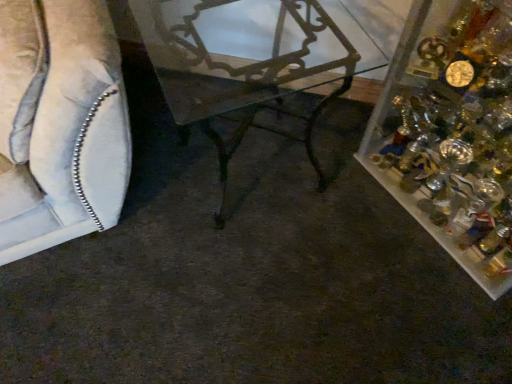
At what (x,y) coordinates should I click in order to perform the action: click on clear plastic container at right. Please return your answer as a coordinate pair (x, y). Looking at the image, I should click on (451, 132).

Locate an element on the screen. This screenshot has height=384, width=512. metallic wrought iron table at center is located at coordinates point(237,72).

Measure the distance between point (84,178) and camera.

Point (84,178) is 1.13 meters from camera.

You are a GUI agent. You are given a task and a screenshot of the screen. Output one action in this format:
    pyautogui.click(x=<x>, y=<y>)
    Task: Click on the clear plastic container at right
    The image size is (512, 384).
    Given the screenshot: What is the action you would take?
    pyautogui.click(x=451, y=132)

Measure the distance between metallic wrought iron table at center and suede-like beige sofa at left.

13.99 inches.

Who is more distant, metallic wrought iron table at center or suede-like beige sofa at left?

metallic wrought iron table at center is further away from the camera.

Looking at this image, is there a large distance between metallic wrought iron table at center and suede-like beige sofa at left?

No, metallic wrought iron table at center is not far away from suede-like beige sofa at left.

From a real-world perspective, does metallic wrought iron table at center sit lower than suede-like beige sofa at left?

Correct, in the physical world, metallic wrought iron table at center is lower than suede-like beige sofa at left.

What are the coordinates of `furniture positioned vertically above the clear plastic container at right (from a real-world perspective)` in the screenshot? It's located at (60, 124).

Looking at this image, looking at their sizes, would you say suede-like beige sofa at left is wider or thinner than clear plastic container at right?

suede-like beige sofa at left is wider than clear plastic container at right.

How many degrees apart are the facing directions of suede-like beige sofa at left and clear plastic container at right?

The angular difference between suede-like beige sofa at left and clear plastic container at right is 79.5 degrees.

Does suede-like beige sofa at left have a lesser height compared to clear plastic container at right?

No, suede-like beige sofa at left is not shorter than clear plastic container at right.

From the image's perspective, which one is positioned lower, suede-like beige sofa at left or metallic wrought iron table at center?

metallic wrought iron table at center, from the image's perspective.

At what (x,y) coordinates should I click in order to perform the action: click on table that appears behind the suede-like beige sofa at left. Please return your answer as a coordinate pair (x, y). This screenshot has width=512, height=384. Looking at the image, I should click on (237, 72).

Is point (18, 0) positioned in front of point (184, 119)?

That is True.

Is clear plastic container at right with suede-like beige sofa at left?

No, clear plastic container at right is not making contact with suede-like beige sofa at left.

Which object is closer to the camera taking this photo, clear plastic container at right or suede-like beige sofa at left?

suede-like beige sofa at left is closer to the camera.

Who is smaller, clear plastic container at right or metallic wrought iron table at center?

metallic wrought iron table at center.

From a real-world perspective, is clear plastic container at right located higher than metallic wrought iron table at center?

Correct, in the physical world, clear plastic container at right is higher than metallic wrought iron table at center.

From the image's perspective, is clear plastic container at right on metallic wrought iron table at center?

No, from the image's perspective, clear plastic container at right is not above metallic wrought iron table at center.

Does clear plastic container at right turn towards metallic wrought iron table at center?

No, clear plastic container at right is not oriented towards metallic wrought iron table at center.

Which is behind, point (220, 215) or point (429, 108)?

Positioned behind is point (429, 108).

Is metallic wrought iron table at center outside of clear plastic container at right?

Yes, metallic wrought iron table at center is outside of clear plastic container at right.

Is metallic wrought iron table at center facing away from clear plastic container at right?

No, metallic wrought iron table at center is not facing the opposite direction of clear plastic container at right.

From the image's perspective, is metallic wrought iron table at center beneath clear plastic container at right?

Incorrect, from the image's perspective, metallic wrought iron table at center is higher than clear plastic container at right.

You are a GUI agent. You are given a task and a screenshot of the screen. Output one action in this format:
    pyautogui.click(x=<x>, y=<y>)
    Task: Click on the table on the right of suede-like beige sofa at left
    This screenshot has width=512, height=384.
    Given the screenshot: What is the action you would take?
    pyautogui.click(x=237, y=72)

Find the location of a particular element. This screenshot has width=512, height=384. christmas decoration beneath the suede-like beige sofa at left (from a real-world perspective) is located at coordinates [451, 132].

Looking at the image, which one is located further to metallic wrought iron table at center, clear plastic container at right or suede-like beige sofa at left?

clear plastic container at right is further to metallic wrought iron table at center.

Considering their positions, is suede-like beige sofa at left positioned closer to metallic wrought iron table at center than clear plastic container at right?

suede-like beige sofa at left lies closer to metallic wrought iron table at center than the other object.

Considering their positions, is clear plastic container at right positioned further to suede-like beige sofa at left than metallic wrought iron table at center?

clear plastic container at right is further to suede-like beige sofa at left.

Looking at the image, which one is located further to suede-like beige sofa at left, metallic wrought iron table at center or clear plastic container at right?

Among the two, clear plastic container at right is located further to suede-like beige sofa at left.

Which object lies nearer to the anchor point clear plastic container at right, suede-like beige sofa at left or metallic wrought iron table at center?

Among the two, metallic wrought iron table at center is located nearer to clear plastic container at right.

When comparing their distances from clear plastic container at right, does metallic wrought iron table at center or suede-like beige sofa at left seem further?

Based on the image, suede-like beige sofa at left appears to be further to clear plastic container at right.

Where is `table located between suede-like beige sofa at left and clear plastic container at right in the left-right direction`? This screenshot has height=384, width=512. table located between suede-like beige sofa at left and clear plastic container at right in the left-right direction is located at coordinates [x=237, y=72].